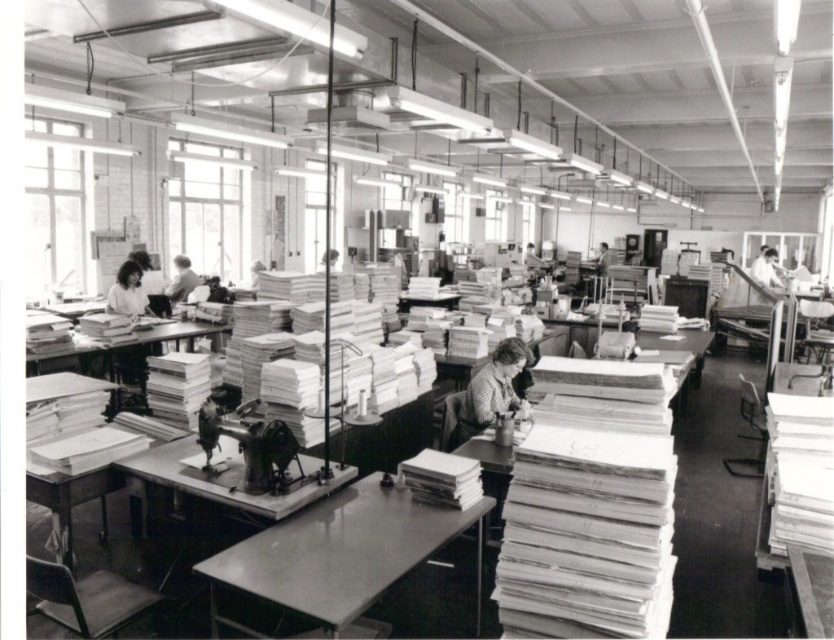
Question: Estimate the real-world distances between objects in this image. Which object is farther from the patterned fabric blouse at center?

Choices:
 (A) smooth white blouse at left
 (B) metallic gray table at center

Answer: (A)

Question: Which point is closer to the camera?

Choices:
 (A) (312, 586)
 (B) (525, 353)

Answer: (A)

Question: Is patterned fabric blouse at center to the right of smooth white blouse at left from the viewer's perspective?

Choices:
 (A) no
 (B) yes

Answer: (B)

Question: Which point is farther to the camera?

Choices:
 (A) (134, 282)
 (B) (515, 401)

Answer: (A)

Question: Does metallic gray table at center appear under patterned fabric blouse at center?

Choices:
 (A) yes
 (B) no

Answer: (A)

Question: Does patterned fabric blouse at center appear under smooth white blouse at left?

Choices:
 (A) no
 (B) yes

Answer: (B)